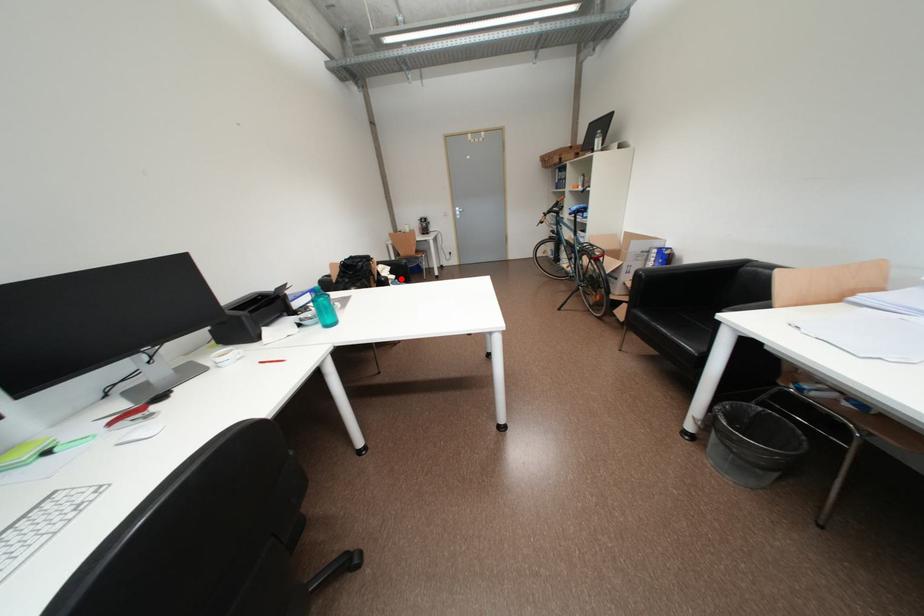
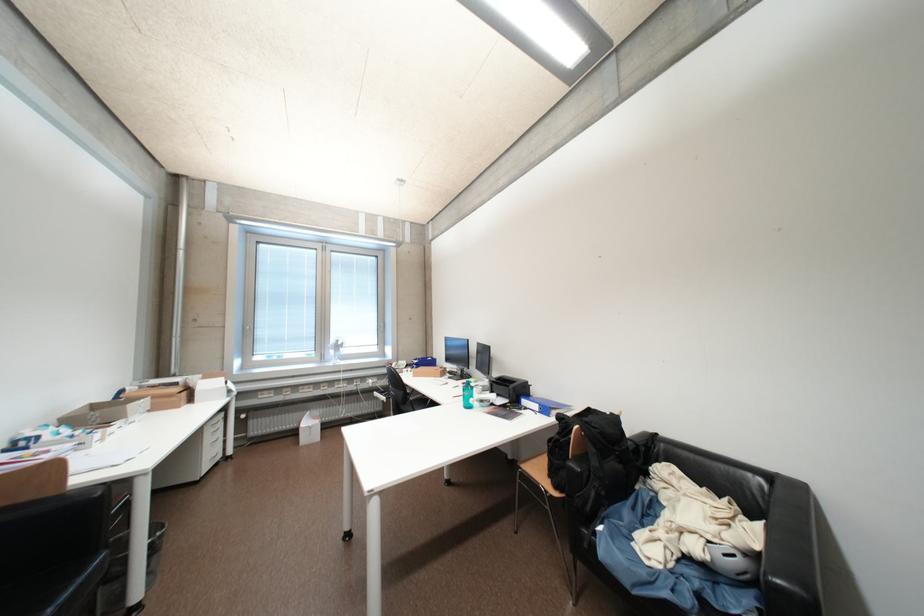
Where in the second image is the point corresponding to the highlighted location from the first image?

(704, 551)